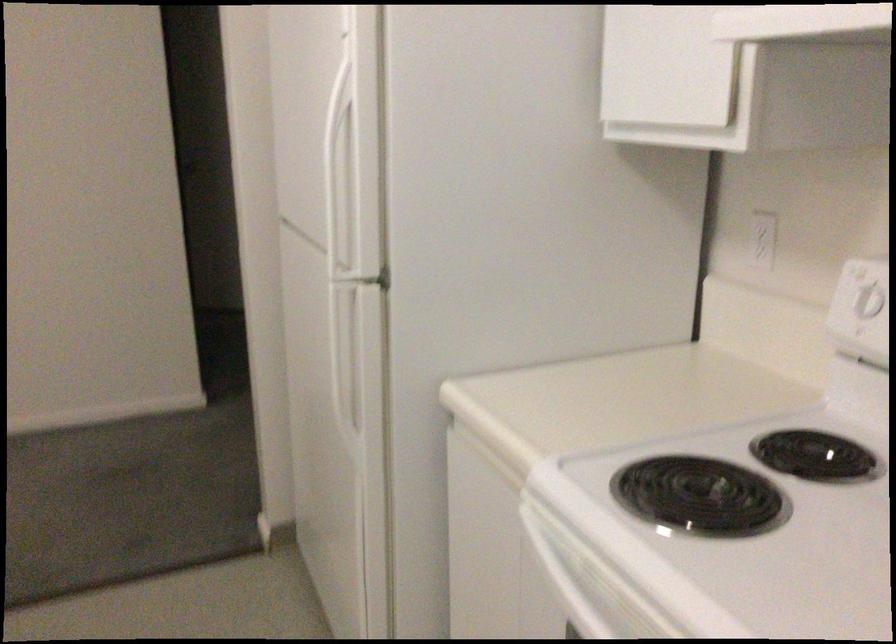
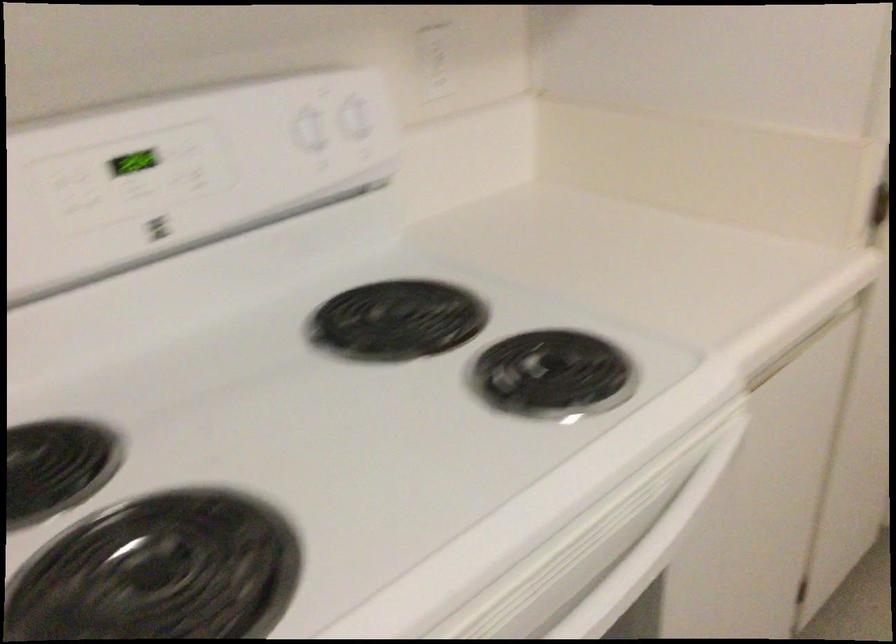
Based on the continuous images, in which direction is the camera rotating?

The rotation direction of the camera is right-down.